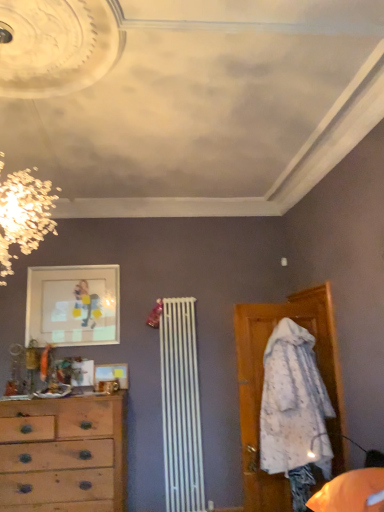
Question: Would you consider wooden picture frame at center, which is the 2th picture frame from top to bottom, to be distant from wooden chest of drawers at left?

Choices:
 (A) no
 (B) yes

Answer: (A)

Question: Would you say wooden picture frame at center, which is the 2th picture frame from top to bottom, contains wooden chest of drawers at left?

Choices:
 (A) no
 (B) yes

Answer: (A)

Question: Is wooden picture frame at center, the 1th picture frame from the bottom, located outside wooden chest of drawers at left?

Choices:
 (A) yes
 (B) no

Answer: (A)

Question: Does wooden picture frame at center, the 1th picture frame from the bottom, have a lesser height compared to wooden chest of drawers at left?

Choices:
 (A) yes
 (B) no

Answer: (A)

Question: Is wooden picture frame at center, which is the 2th picture frame from top to bottom, wider than wooden chest of drawers at left?

Choices:
 (A) yes
 (B) no

Answer: (B)

Question: Is wooden chest of drawers at left in front of or behind matte glass picture frame at upper left, the 2th picture frame in the bottom-to-top sequence, in the image?

Choices:
 (A) front
 (B) behind

Answer: (A)

Question: Considering the positions of wooden chest of drawers at left and matte glass picture frame at upper left, the 2th picture frame in the bottom-to-top sequence, in the image, is wooden chest of drawers at left wider or thinner than matte glass picture frame at upper left, the 2th picture frame in the bottom-to-top sequence,?

Choices:
 (A) wide
 (B) thin

Answer: (A)

Question: In the image, is wooden chest of drawers at left on the left side or the right side of matte glass picture frame at upper left, the 2th picture frame in the bottom-to-top sequence?

Choices:
 (A) right
 (B) left

Answer: (A)

Question: Choose the correct answer: Is wooden chest of drawers at left inside matte glass picture frame at upper left, the 2th picture frame in the bottom-to-top sequence, or outside it?

Choices:
 (A) inside
 (B) outside

Answer: (B)

Question: Considering their positions, is wooden picture frame at center, which is the 2th picture frame from top to bottom, located in front of or behind matte glass picture frame at upper left, the 2th picture frame in the bottom-to-top sequence?

Choices:
 (A) front
 (B) behind

Answer: (A)

Question: Based on their positions, is wooden picture frame at center, the 1th picture frame from the bottom, located to the left or right of matte glass picture frame at upper left, positioned as the 1th picture frame in top-to-bottom order?

Choices:
 (A) right
 (B) left

Answer: (A)

Question: From a real-world perspective, is wooden picture frame at center, which is the 2th picture frame from top to bottom, physically located above or below matte glass picture frame at upper left, positioned as the 1th picture frame in top-to-bottom order?

Choices:
 (A) below
 (B) above

Answer: (A)

Question: From the image's perspective, relative to matte glass picture frame at upper left, positioned as the 1th picture frame in top-to-bottom order, is wooden picture frame at center, the 1th picture frame from the bottom, above or below?

Choices:
 (A) below
 (B) above

Answer: (A)

Question: Does point (127, 386) appear closer or farther from the camera than point (99, 453)?

Choices:
 (A) closer
 (B) farther

Answer: (B)

Question: Based on their positions, is wooden picture frame at center, which is the 2th picture frame from top to bottom, located to the left or right of wooden chest of drawers at left?

Choices:
 (A) left
 (B) right

Answer: (B)